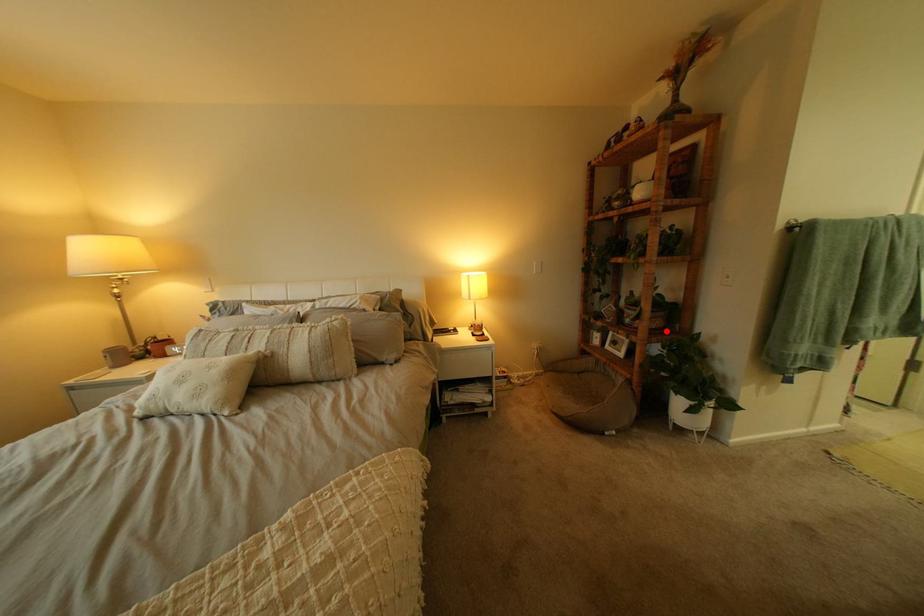
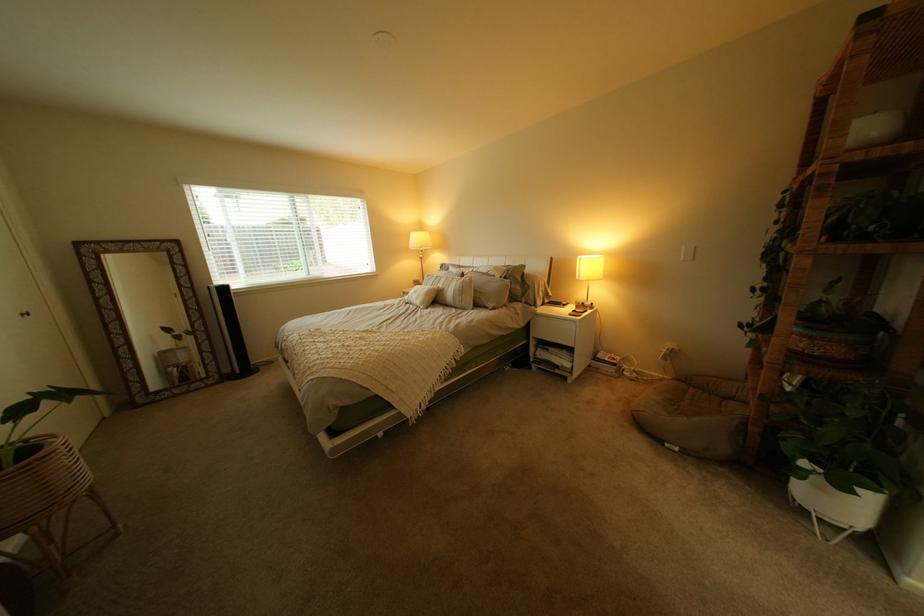
Find the pixel in the second image that matches the highlighted location in the first image.

(805, 354)